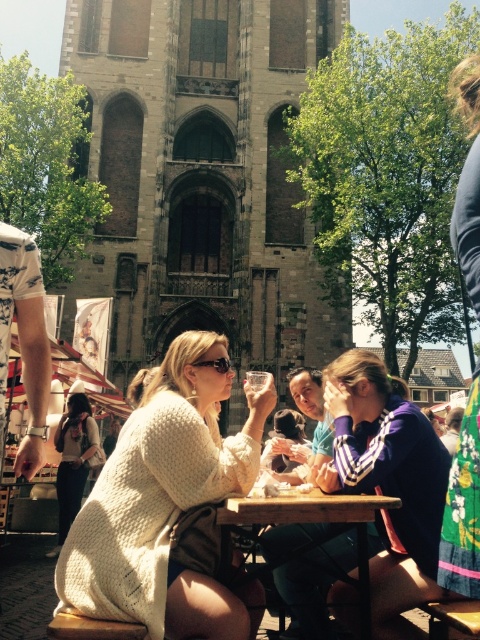
You are a photographer trying to capture a photo of the purple jersey at center and the wooden table at center. Which object should you focus on first if you want to ensure both are in sharp focus, considering their sizes?

The purple jersey at center has a larger size compared to the wooden table at center, so you should focus on the purple jersey at center first to ensure both are in sharp focus.

You are standing at the edge of the town square and want to place a purple jersey at center on a wooden table at center. Can you reach the table without moving any objects in the scene?

The purple jersey at center is 14.75 feet away from the wooden table at center. Since the distance is too far, you cannot reach the table without moving any objects in the scene.

You are standing in the town square and want to take a photo of the historic building. You notice two points marked in the scene. Which point, point [301,522] or point [264,372], is closer to your camera lens?

Point [301,522] is closer to the camera lens than point [264,372].